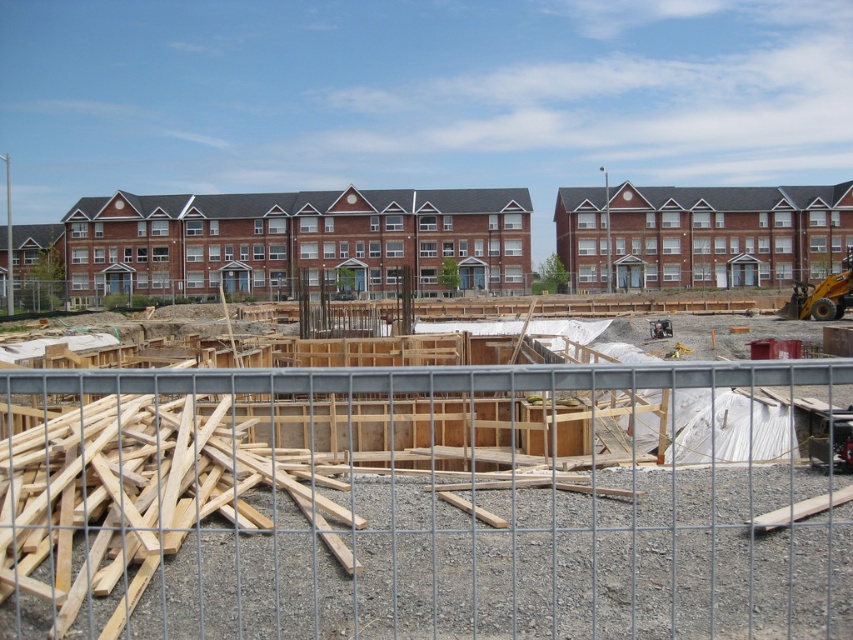
Question: Is gray metal fence at center thinner than brick building at center?

Choices:
 (A) yes
 (B) no

Answer: (A)

Question: Can you confirm if gray metal fence at center is smaller than brick building at center?

Choices:
 (A) no
 (B) yes

Answer: (B)

Question: Can you confirm if gray metal fence at center is positioned to the right of brick building at center?

Choices:
 (A) yes
 (B) no

Answer: (B)

Question: Which of the following is the farthest from the observer?

Choices:
 (A) brick building at center
 (B) gray metal fence at center

Answer: (A)

Question: Which object is farther from the camera taking this photo?

Choices:
 (A) gray metal fence at center
 (B) brick building at center

Answer: (B)